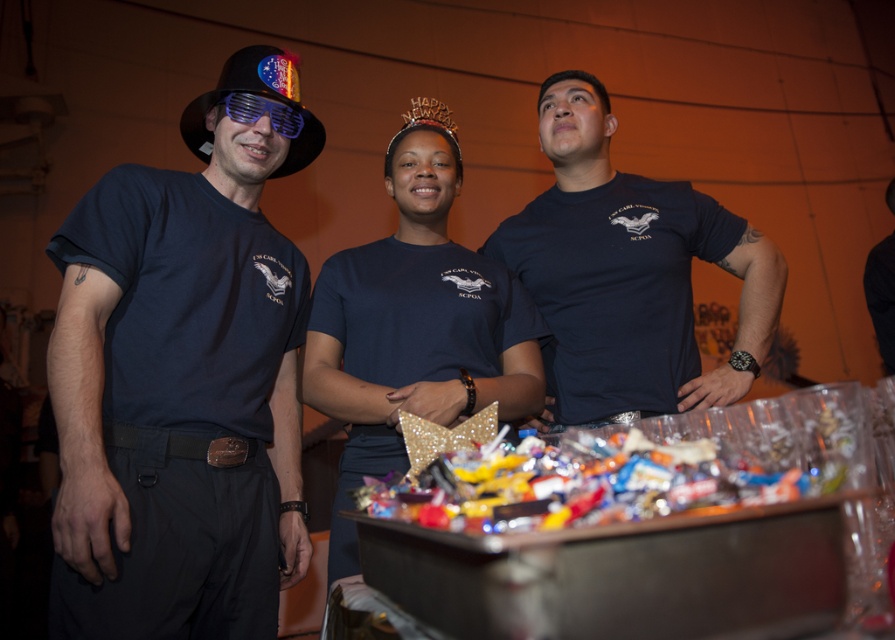
Question: Can you confirm if glossy plastic tray at center is positioned to the left of black fabric party hat at upper left?

Choices:
 (A) yes
 (B) no

Answer: (B)

Question: Is glossy plastic tray at center behind black fabric party hat at upper left?

Choices:
 (A) no
 (B) yes

Answer: (A)

Question: Which point is farther to the camera?

Choices:
 (A) black fabric party hat at upper left
 (B) glossy plastic tray at center
 (C) dark blue t-shirt at center
 (D) matte black t-shirt at left

Answer: (A)

Question: Among these objects, which one is farthest from the camera?

Choices:
 (A) matte black t-shirt at left
 (B) black fabric party hat at upper left
 (C) dark blue t-shirt at center

Answer: (B)

Question: Is matte black t-shirt at left positioned behind black fabric party hat at upper left?

Choices:
 (A) yes
 (B) no

Answer: (B)

Question: Which of the following is the closest to the observer?

Choices:
 (A) glossy plastic tray at center
 (B) matte black t-shirt at left
 (C) black fabric party hat at upper left

Answer: (A)